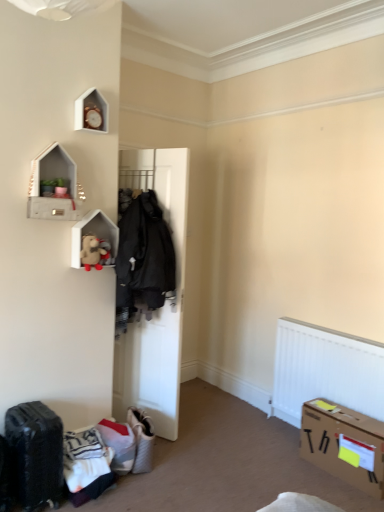
Identify the location of free area in between cardboard box at lower right and white textured fabric suitcase at lower center, which is the 2th luggage in left-to-right order. Image resolution: width=384 pixels, height=512 pixels. tap(240, 466).